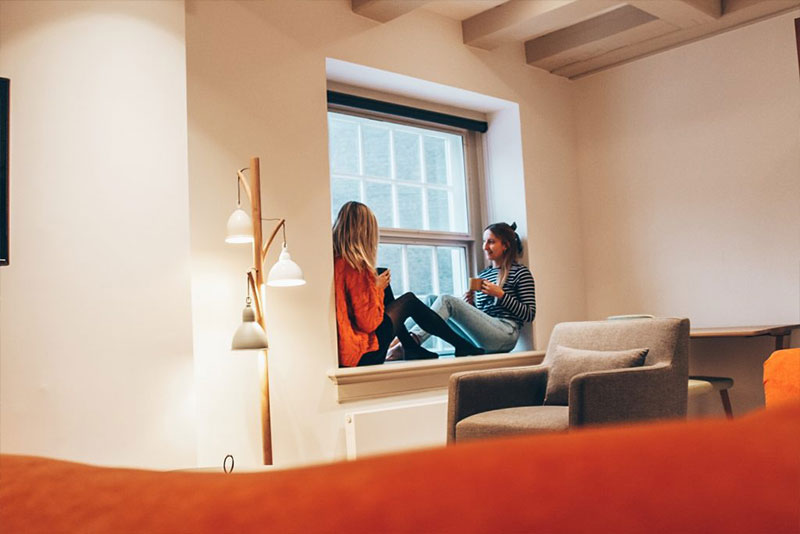
This screenshot has width=800, height=534. I want to click on largest empty wall, so click(x=706, y=185).